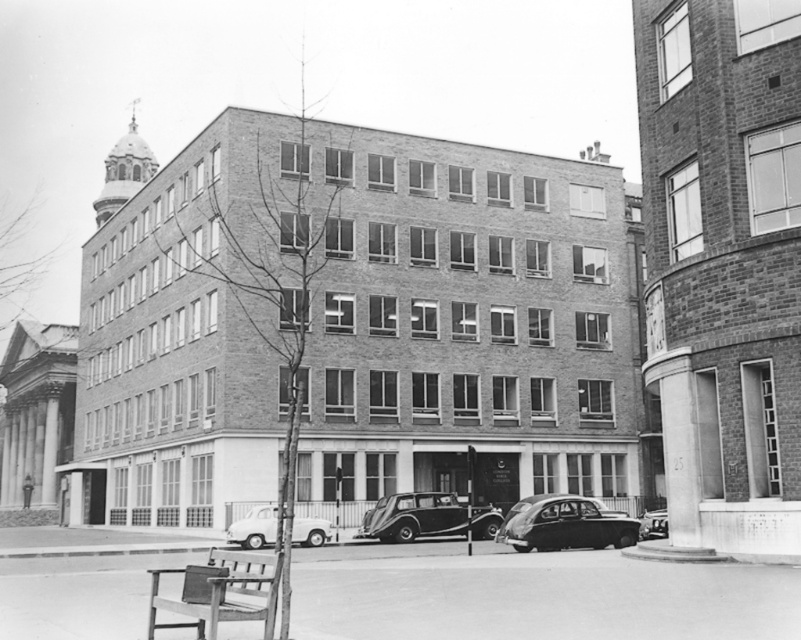
Question: Can you confirm if wooden park bench at lower left is positioned to the left of shiny black car at center?

Choices:
 (A) yes
 (B) no

Answer: (A)

Question: Is the position of shiny black car at center more distant than that of shiny black car at lower right?

Choices:
 (A) no
 (B) yes

Answer: (A)

Question: Among these objects, which one is nearest to the camera?

Choices:
 (A) wooden park bench at lower left
 (B) shiny black car at center
 (C) shiny black car at lower right

Answer: (A)

Question: Which of these objects is positioned closest to the shiny silver car at center?

Choices:
 (A) white matte van at lower center
 (B) wooden park bench at lower left

Answer: (A)

Question: Does shiny black car at center appear on the right side of shiny black car at lower right?

Choices:
 (A) no
 (B) yes

Answer: (A)

Question: Which object is farther from the camera taking this photo?

Choices:
 (A) shiny silver car at center
 (B) shiny black car at center
 (C) wooden park bench at lower left
 (D) shiny black car at lower right

Answer: (A)